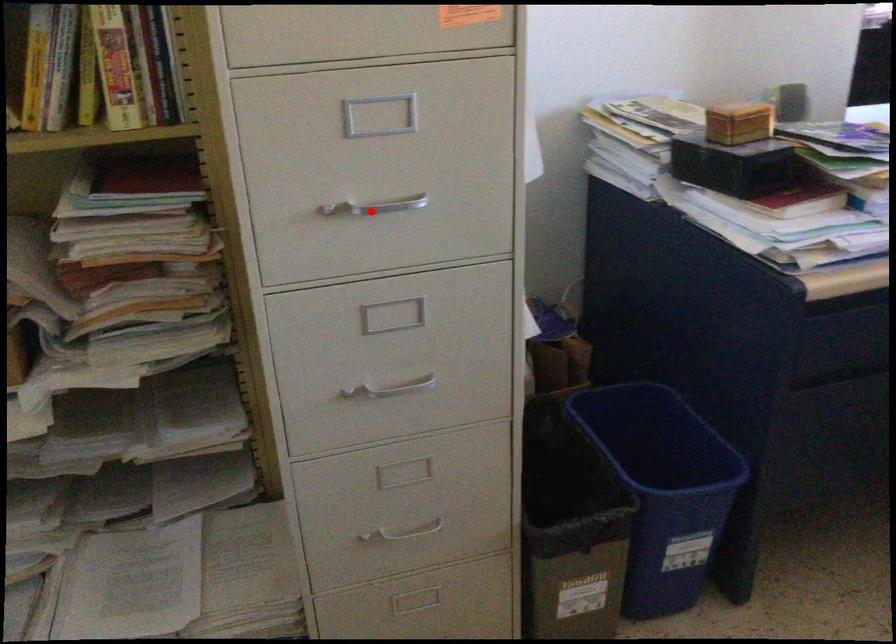
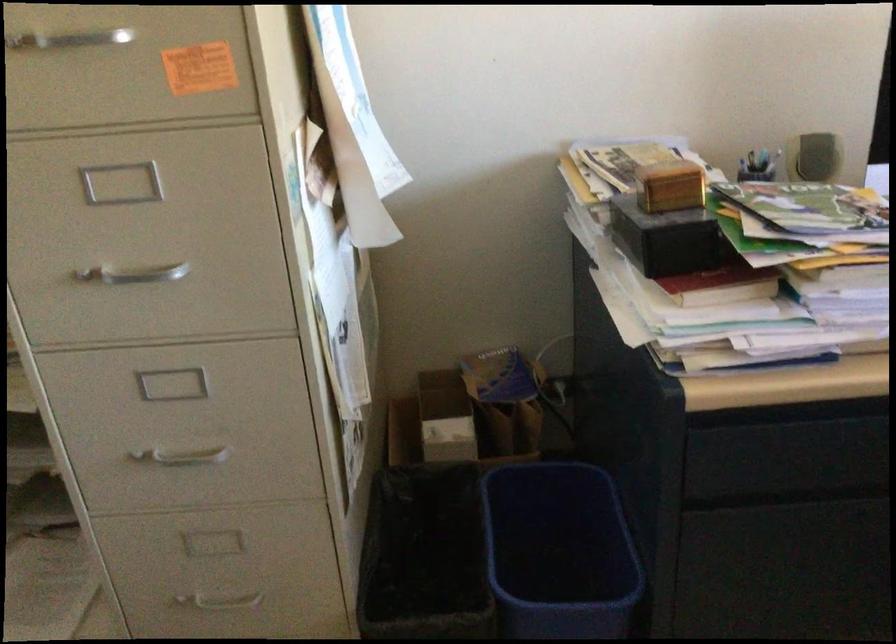
Locate, in the second image, the point that corresponds to the highlighted location in the first image.

(134, 274)